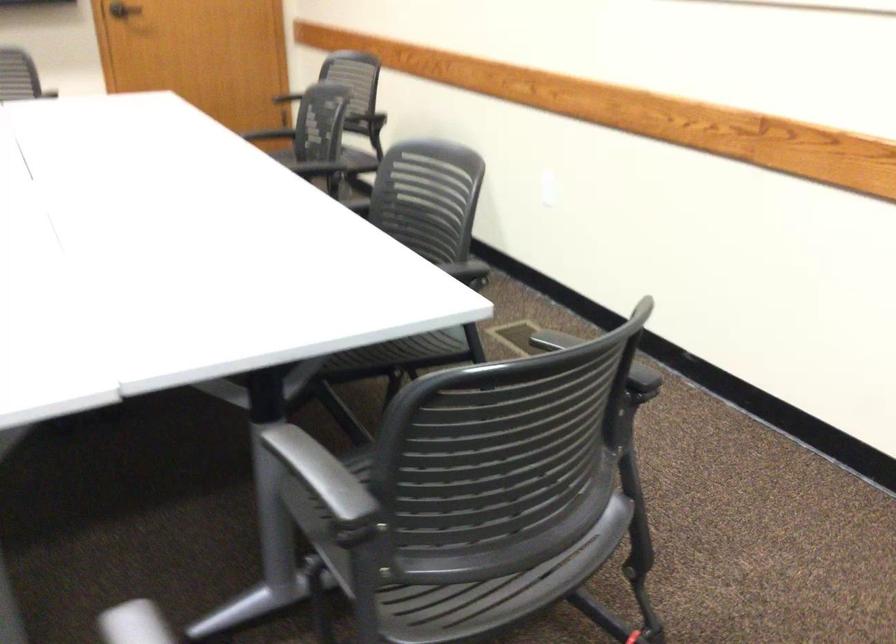
What do you see at coordinates (598, 359) in the screenshot? I see `the black chair armrest` at bounding box center [598, 359].